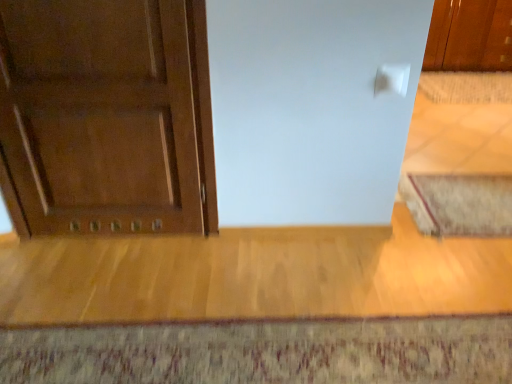
Question: From the image's perspective, is textured wool doormat at lower center, arranged as the 1th doormat when ordered from the bottom, above or below beige textured rug at lower right, the 2th doormat from the left?

Choices:
 (A) above
 (B) below

Answer: (B)

Question: Considering the positions of textured wool doormat at lower center, which ranks as the third doormat in right-to-left order, and beige textured rug at lower right, acting as the 2th doormat starting from the back, in the image, is textured wool doormat at lower center, which ranks as the third doormat in right-to-left order, wider or thinner than beige textured rug at lower right, acting as the 2th doormat starting from the back,?

Choices:
 (A) wide
 (B) thin

Answer: (A)

Question: Estimate the real-world distances between objects in this image. Which object is closer to the beige textured rug at lower right, which is the second doormat in front-to-back order?

Choices:
 (A) matte wood door at left
 (B) glossy wood cabinet at upper right
 (C) textured wool doormat at lower center, which is counted as the 3th doormat, starting from the back
 (D) beige woven mat at right, the 1th doormat in the right-to-left sequence

Answer: (C)

Question: Considering the real-world distances, which object is farthest from the beige textured rug at lower right, acting as the 2th doormat starting from the back?

Choices:
 (A) textured wool doormat at lower center, which ranks as the third doormat in right-to-left order
 (B) matte wood door at left
 (C) glossy wood cabinet at upper right
 (D) beige woven mat at right, the 3th doormat in the bottom-to-top sequence

Answer: (C)